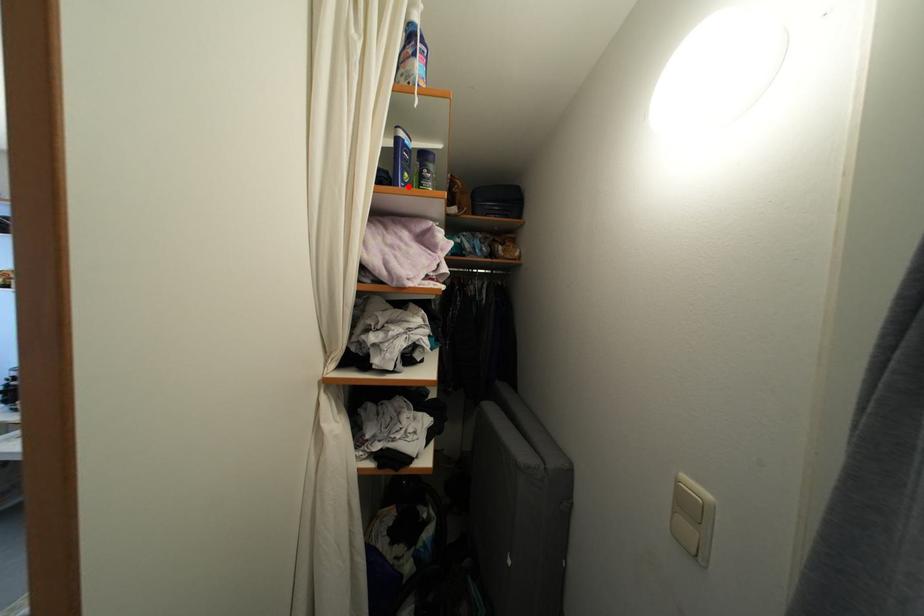
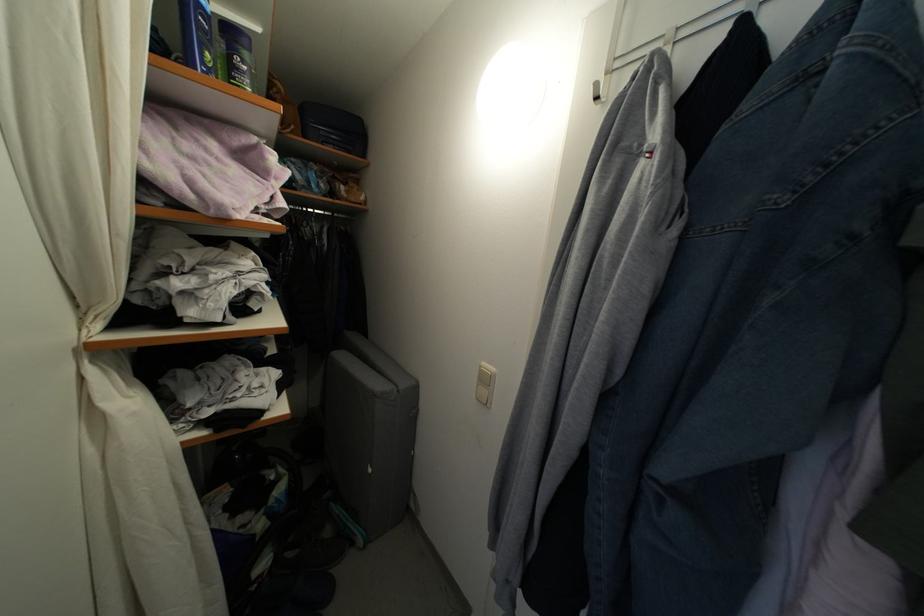
Locate, in the second image, the point that corresponds to the highlighted location in the first image.

(210, 70)